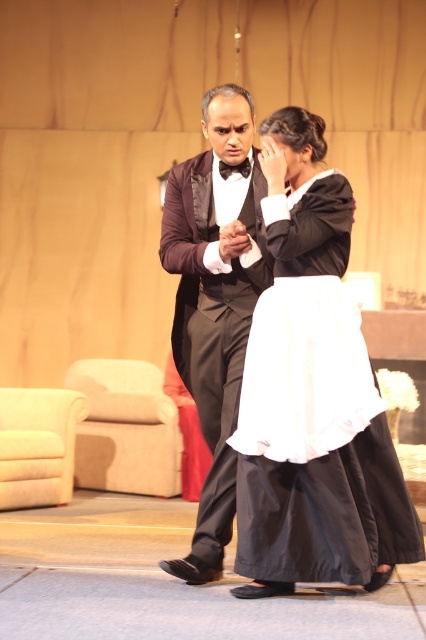
Is matte black dress at center behind shiny black tuxedo at center?

No, matte black dress at center is in front of shiny black tuxedo at center.

Is matte black dress at center to the left of shiny black tuxedo at center from the viewer's perspective?

In fact, matte black dress at center is to the right of shiny black tuxedo at center.

This screenshot has width=426, height=640. Find the location of `matte black dress at center`. matte black dress at center is located at coordinates (313, 394).

Who is more forward, (229, 362) or (239, 168)?

Positioned in front is point (229, 362).

Does shiny black tuxedo at center have a greater width compared to black satin bow tie at center?

Correct, the width of shiny black tuxedo at center exceeds that of black satin bow tie at center.

Between point (256, 275) and point (235, 166), which one is positioned behind?

Positioned behind is point (235, 166).

Find the location of a particular element. shiny black tuxedo at center is located at coordinates (213, 304).

Is matte black dress at center smaller than black satin bow tie at center?

No, matte black dress at center is not smaller than black satin bow tie at center.

Is matte black dress at center behind black satin bow tie at center?

No, it is not.

What do you see at coordinates (313, 394) in the screenshot? This screenshot has width=426, height=640. I see `matte black dress at center` at bounding box center [313, 394].

Image resolution: width=426 pixels, height=640 pixels. I want to click on matte black dress at center, so click(x=313, y=394).